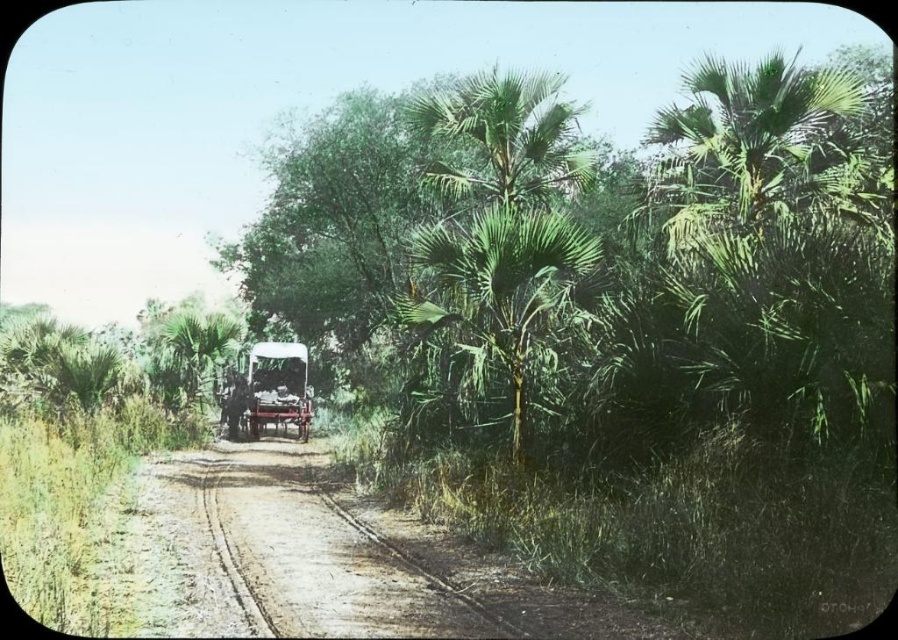
Consider the image. You are standing at the starting point of the dirt road and want to reach the horse drawn cart that is moving away. There is a green leafy palm at center in your way. Can you walk around it on either side?

The green leafy palm at center is located at point (507,209). Since the palm is positioned centrally on the road, you can go around it on either the left or right side to continue towards the horse drawn cart.

You are driving a tractor that is 2 meters wide. You see the brown dirt track at center and the wooden cart at center. Can your tractor pass through the space between them?

The brown dirt track at center is in front of the wooden cart at center, so there is no space between them for the tractor to pass through.

You are a photographer standing at the starting point of the dirt road. You want to take a photo that includes both point (368,529) and point (496,116). Which point will appear larger in your photo?

Point (368,529) will appear larger in the photo because it is closer to the camera than point (496,116).